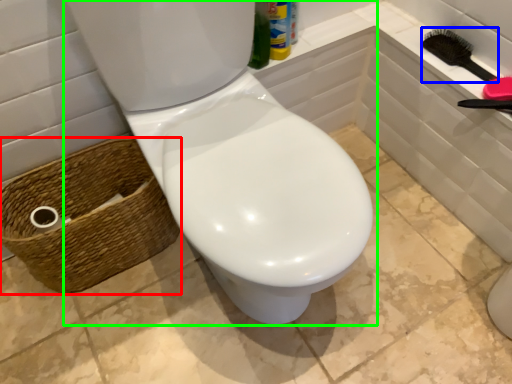
Question: Which object is positioned closest to basket (highlighted by a red box)? Select from brush (highlighted by a blue box) and toilet (highlighted by a green box).

Choices:
 (A) brush
 (B) toilet

Answer: (B)